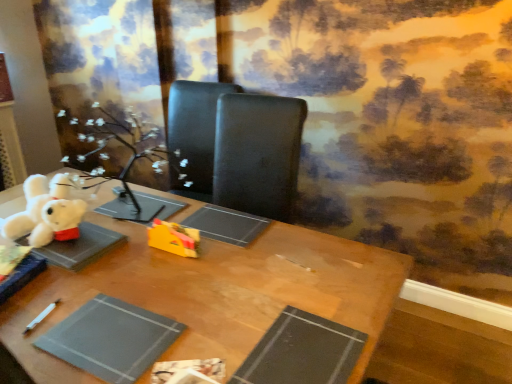
Question: Is black matte paperback book at lower center, which is counted as the 1th paperback book, starting from the right, inside gray matte paper at lower left, which appears as the first paperback book when viewed from the left?

Choices:
 (A) yes
 (B) no

Answer: (B)

Question: From a real-world perspective, is gray matte paper at lower left, which appears as the first paperback book when viewed from the left, located beneath black matte paperback book at lower center, which is counted as the 1th paperback book, starting from the right?

Choices:
 (A) yes
 (B) no

Answer: (A)

Question: Does gray matte paper at lower left, which ranks as the 2th paperback book in right-to-left order, have a greater height compared to black matte paperback book at lower center, marked as the second paperback book in a left-to-right arrangement?

Choices:
 (A) yes
 (B) no

Answer: (A)

Question: Can you confirm if gray matte paper at lower left, which appears as the first paperback book when viewed from the left, is thinner than black matte paperback book at lower center, which is counted as the 1th paperback book, starting from the right?

Choices:
 (A) yes
 (B) no

Answer: (B)

Question: Can you confirm if gray matte paper at lower left, which appears as the first paperback book when viewed from the left, is positioned to the left of black matte paperback book at lower center, which is counted as the 1th paperback book, starting from the right?

Choices:
 (A) no
 (B) yes

Answer: (B)

Question: Considering the relative sizes of gray matte paper at lower left, which appears as the first paperback book when viewed from the left, and black matte paperback book at lower center, which is counted as the 1th paperback book, starting from the right, in the image provided, is gray matte paper at lower left, which appears as the first paperback book when viewed from the left, wider than black matte paperback book at lower center, which is counted as the 1th paperback book, starting from the right,?

Choices:
 (A) yes
 (B) no

Answer: (A)

Question: Can you confirm if gray matte paper at lower left, which ranks as the 2th paperback book in right-to-left order, is bigger than wooden table at center?

Choices:
 (A) no
 (B) yes

Answer: (A)

Question: Would you consider gray matte paper at lower left, which appears as the first paperback book when viewed from the left, to be distant from wooden table at center?

Choices:
 (A) no
 (B) yes

Answer: (A)

Question: From the image's perspective, is gray matte paper at lower left, which appears as the first paperback book when viewed from the left, located beneath wooden table at center?

Choices:
 (A) yes
 (B) no

Answer: (B)

Question: Is the depth of gray matte paper at lower left, which ranks as the 2th paperback book in right-to-left order, greater than that of wooden table at center?

Choices:
 (A) no
 (B) yes

Answer: (B)

Question: From a real-world perspective, is gray matte paper at lower left, which ranks as the 2th paperback book in right-to-left order, located beneath wooden table at center?

Choices:
 (A) yes
 (B) no

Answer: (B)

Question: From the image's perspective, does gray matte paper at lower left, which ranks as the 2th paperback book in right-to-left order, appear higher than wooden table at center?

Choices:
 (A) no
 (B) yes

Answer: (B)

Question: Is white plush bear at upper left, arranged as the 1th toy when viewed from the left, shorter than black matte paperback book at lower center, marked as the second paperback book in a left-to-right arrangement?

Choices:
 (A) yes
 (B) no

Answer: (B)